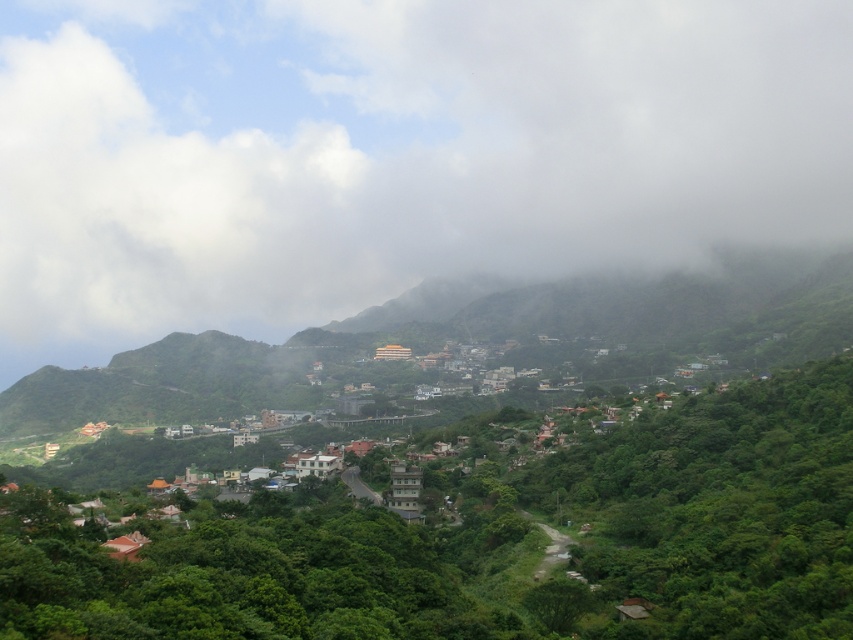
Question: Is white fluffy cloud at upper center wider than white stucco houses at center?

Choices:
 (A) yes
 (B) no

Answer: (A)

Question: Which of the following is the farthest from the observer?

Choices:
 (A) (138, 17)
 (B) (74, 380)

Answer: (A)

Question: Can you confirm if white fluffy cloud at upper center is positioned above white stucco houses at center?

Choices:
 (A) no
 (B) yes

Answer: (B)

Question: Which of the following is the closest to the observer?

Choices:
 (A) (189, 449)
 (B) (686, 253)

Answer: (A)

Question: Is white fluffy cloud at upper center closer to camera compared to white stucco houses at center?

Choices:
 (A) yes
 (B) no

Answer: (B)

Question: Which object appears closest to the camera in this image?

Choices:
 (A) white fluffy cloud at upper center
 (B) white stucco houses at center

Answer: (B)